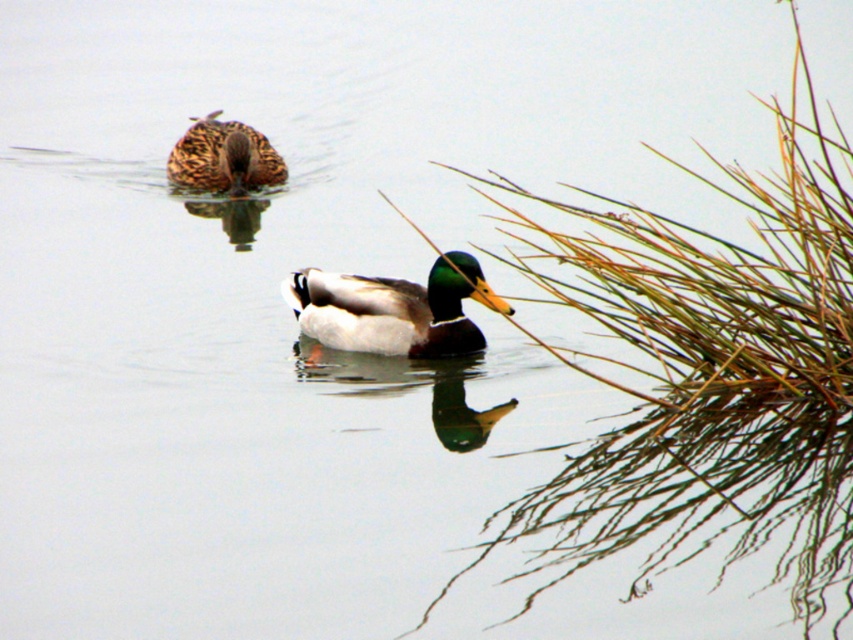
Question: Which point is closer to the camera?

Choices:
 (A) (238, 129)
 (B) (314, 272)

Answer: (B)

Question: Observing the image, what is the correct spatial positioning of brown grass at right in reference to brown matte duck at upper left?

Choices:
 (A) right
 (B) left

Answer: (A)

Question: Which of these objects is positioned closest to the brown grass at right?

Choices:
 (A) brown matte duck at upper left
 (B) shiny green and white duck at center

Answer: (B)

Question: Is brown grass at right below shiny green and white duck at center?

Choices:
 (A) no
 (B) yes

Answer: (B)

Question: Which point appears closest to the camera in this image?

Choices:
 (A) (467, 260)
 (B) (682, 468)

Answer: (B)

Question: Considering the relative positions of brown grass at right and shiny green and white duck at center in the image provided, where is brown grass at right located with respect to shiny green and white duck at center?

Choices:
 (A) below
 (B) above

Answer: (A)